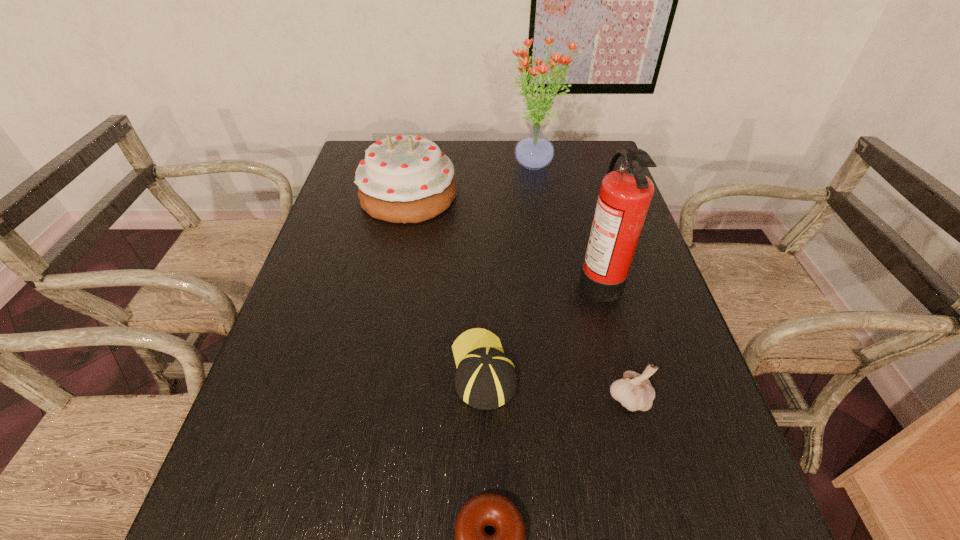
Locate an element on the screen. The height and width of the screenshot is (540, 960). flower arrangement is located at coordinates [x=534, y=151].

Locate an element on the screen. the third farthest object is located at coordinates (625, 195).

The image size is (960, 540). I want to click on the fourth shortest object, so click(404, 179).

Image resolution: width=960 pixels, height=540 pixels. Identify the location of the leftmost object. (404, 179).

You are a GUI agent. You are given a task and a screenshot of the screen. Output one action in this format:
    pyautogui.click(x=<x>, y=<y>)
    Task: Click on the garlic
    
    Given the screenshot: What is the action you would take?
    pyautogui.click(x=635, y=392)

The height and width of the screenshot is (540, 960). What are the coordinates of `the fifth tallest object` in the screenshot? It's located at (486, 379).

You are a GUI agent. You are given a task and a screenshot of the screen. Output one action in this format:
    pyautogui.click(x=<x>, y=<y>)
    Task: Click on the vacant region located 0.090m on the right of the flower arrangement
    This screenshot has height=540, width=960.
    Given the screenshot: What is the action you would take?
    pyautogui.click(x=593, y=165)

Find the location of `vacant space located 0.240m on the front-facing side of the fourth nearest object`. vacant space located 0.240m on the front-facing side of the fourth nearest object is located at coordinates (482, 278).

At what (x,y) coordinates should I click in order to perform the action: click on vacant area situated 0.320m on the front-facing side of the fourth nearest object. Please return your answer as a coordinate pair (x, y). The width and height of the screenshot is (960, 540). Looking at the image, I should click on (450, 278).

The height and width of the screenshot is (540, 960). I want to click on free location located on the front-facing side of the fourth nearest object, so click(x=517, y=278).